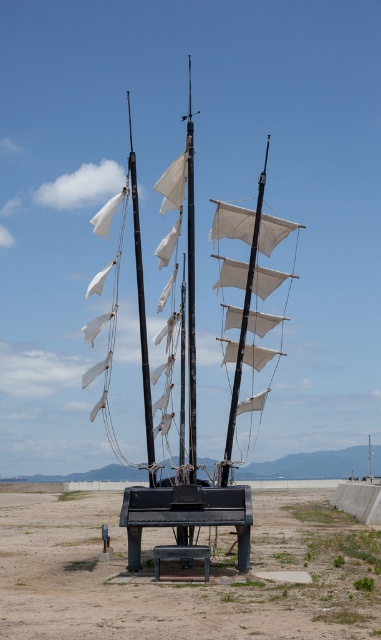
Question: Which point appears farthest from the camera in this image?

Choices:
 (A) (155, 493)
 (B) (180, 385)
 (C) (11, 506)

Answer: (C)

Question: In this image, where is metallic matte sailboat at center located relative to black matte bench at center?

Choices:
 (A) below
 (B) above

Answer: (B)

Question: From the image, what is the correct spatial relationship of dirt field at lower center in relation to black matte bench at center?

Choices:
 (A) below
 (B) above

Answer: (A)

Question: Which point is farther to the camera?

Choices:
 (A) (96, 275)
 (B) (267, 499)
 (C) (225, 518)

Answer: (A)

Question: Is the position of dirt field at lower center less distant than that of metallic matte sailboat at center?

Choices:
 (A) yes
 (B) no

Answer: (A)

Question: Which object appears closest to the camera in this image?

Choices:
 (A) dirt field at lower center
 (B) black matte bench at center

Answer: (A)